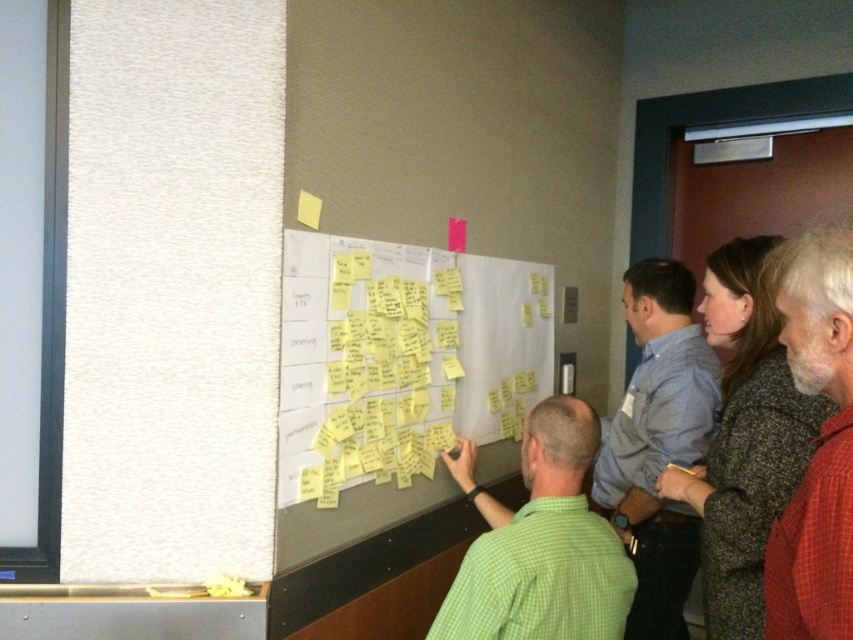
Question: Is green checkered shirt at center positioned in front of red plaid shirt at right?

Choices:
 (A) yes
 (B) no

Answer: (B)

Question: Estimate the real-world distances between objects in this image. Which object is closer to the blue shirt at right?

Choices:
 (A) red plaid shirt at right
 (B) green checkered shirt at center
 (C) yellow sticky notes at center

Answer: (C)

Question: Estimate the real-world distances between objects in this image. Which object is farther from the yellow sticky notes at center?

Choices:
 (A) red plaid shirt at right
 (B) blue shirt at right
 (C) green checkered shirt at center

Answer: (A)

Question: Does yellow sticky notes at center have a lesser width compared to blue shirt at right?

Choices:
 (A) yes
 (B) no

Answer: (B)

Question: Which of the following is the farthest from the observer?

Choices:
 (A) (590, 588)
 (B) (659, 540)

Answer: (B)

Question: Does green checkered shirt at center have a greater width compared to blue shirt at right?

Choices:
 (A) no
 (B) yes

Answer: (B)